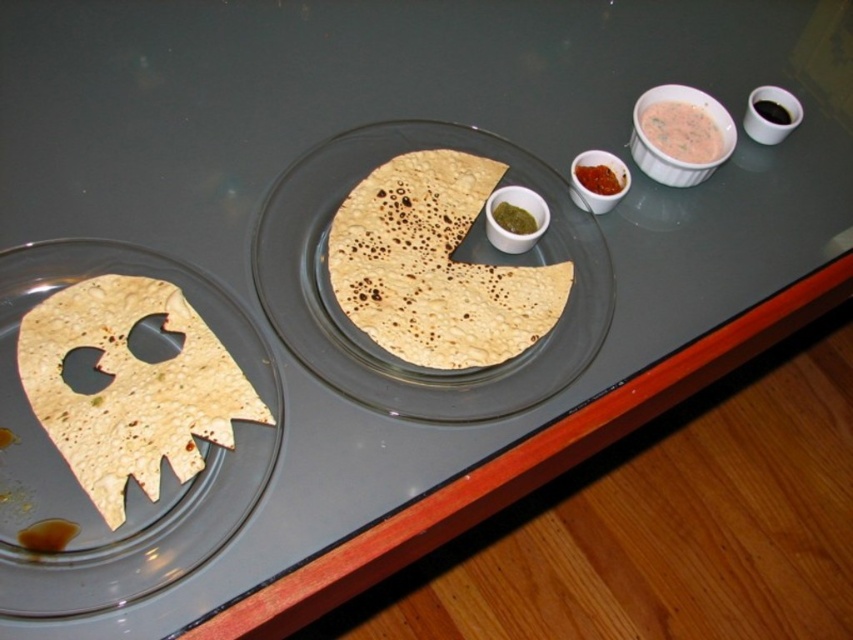
Question: Which of these objects is positioned closest to the brown matte flatbread at center?

Choices:
 (A) bright red paste at upper center
 (B) white creamy dip at upper right
 (C) brown crispy tortilla at left

Answer: (A)

Question: Does matte glass plate at center lie behind brown matte flatbread at center?

Choices:
 (A) no
 (B) yes

Answer: (A)

Question: Where is white creamy dip at upper right located in relation to bright red paste at upper center in the image?

Choices:
 (A) above
 (B) below

Answer: (A)

Question: Which of the following is the farthest from the observer?

Choices:
 (A) (699, 106)
 (B) (589, 346)

Answer: (A)

Question: From the image, what is the correct spatial relationship of brown matte flatbread at center in relation to white creamy dip at upper right?

Choices:
 (A) above
 (B) below

Answer: (B)

Question: Which object appears closest to the camera in this image?

Choices:
 (A) brown matte flatbread at center
 (B) brown crispy tortilla at left
 (C) matte glass plate at center
 (D) bright red paste at upper center

Answer: (B)